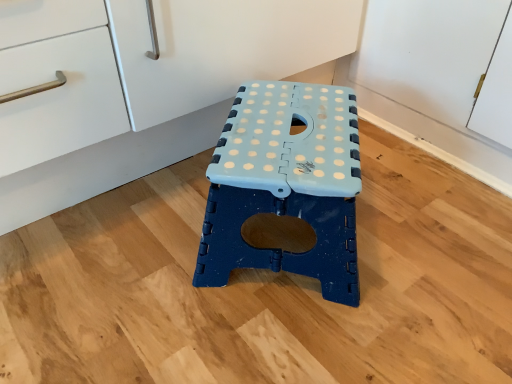
The image size is (512, 384). Find the location of `vacant space situated on the left part of blue plastic stool at center`. vacant space situated on the left part of blue plastic stool at center is located at coordinates (121, 248).